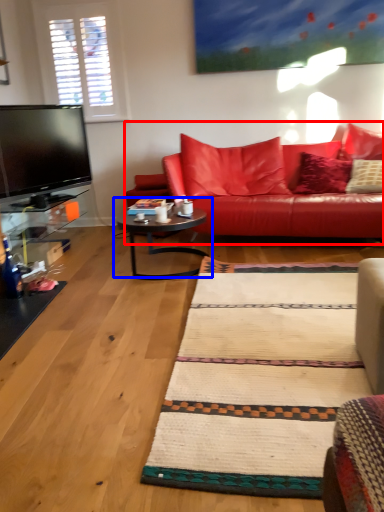
Question: Among these objects, which one is farthest to the camera, studio couch (highlighted by a red box) or coffee table (highlighted by a blue box)?

Choices:
 (A) studio couch
 (B) coffee table

Answer: (A)